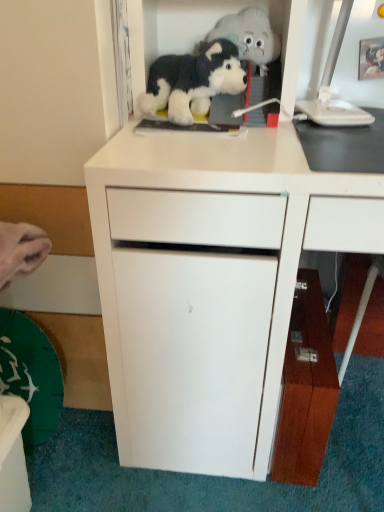
Find the location of a particular element. free spot above wooden cabinet at lower right, the second cabinetry viewed from the left (from a real-world perspective) is located at coordinates (306, 326).